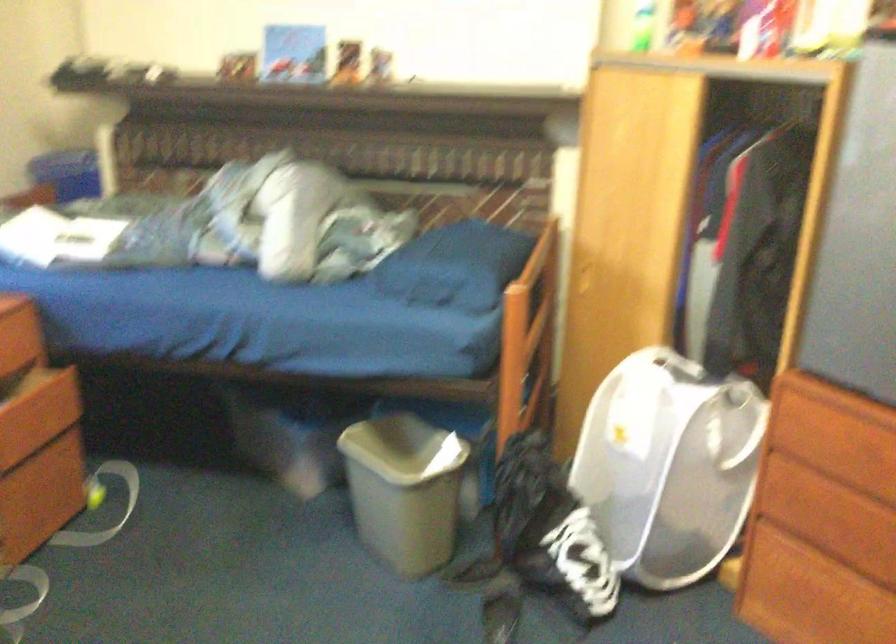
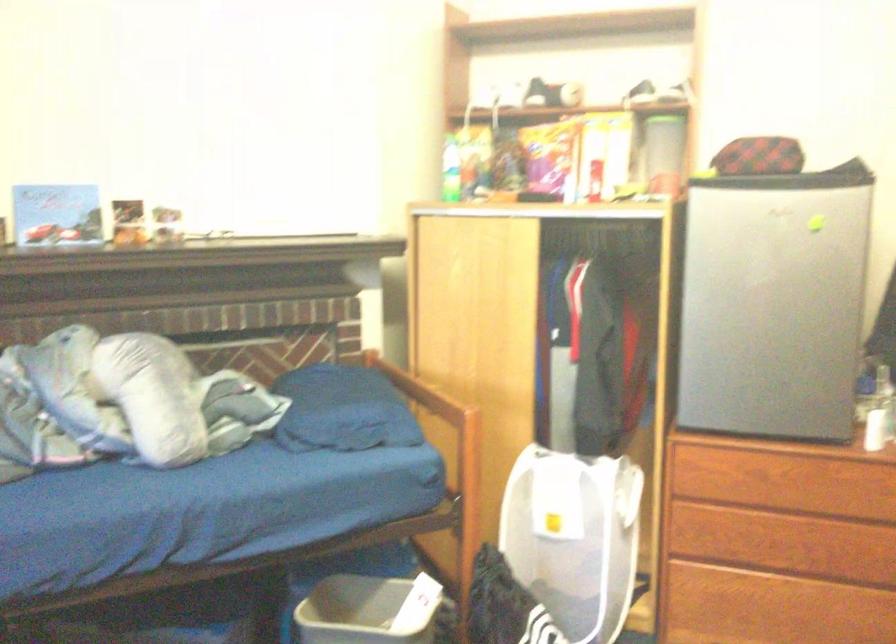
In the second image, find the point that corresponds to (425,453) in the first image.

(368, 611)